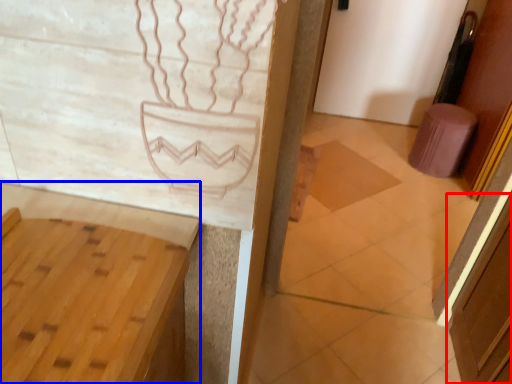
Question: Which of the following is the farthest to the observer, screen door (highlighted by a red box) or vanity (highlighted by a blue box)?

Choices:
 (A) screen door
 (B) vanity

Answer: (A)